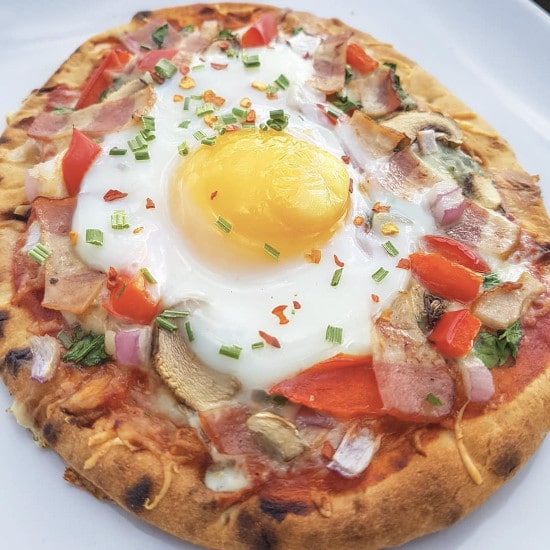
Identify the location of plate. click(x=521, y=30), click(x=22, y=515).